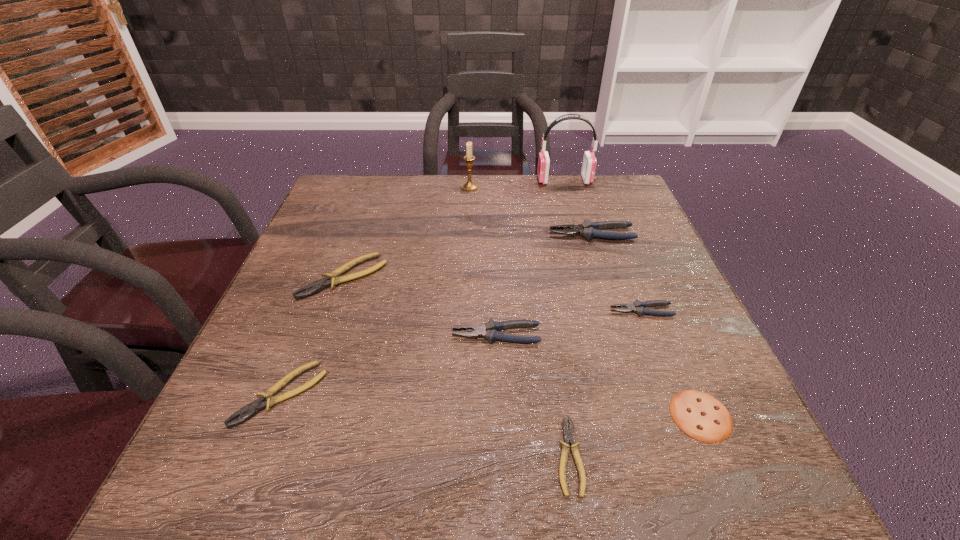
Find the location of `vacant space located on the back of the cookie`. vacant space located on the back of the cookie is located at coordinates (648, 291).

At what (x,y) coordinates should I click in order to perform the action: click on vacant space located 0.140m on the left of the shortest object. Please return your answer as a coordinate pair (x, y). Looking at the image, I should click on (464, 456).

Identify the location of earphone at the far edge. Image resolution: width=960 pixels, height=540 pixels. (589, 160).

Identify the location of candle holder present at the far edge. (469, 185).

I want to click on object that is at the near edge, so click(x=568, y=435).

This screenshot has width=960, height=540. I want to click on earphone at the right edge, so click(589, 160).

Find the location of `cookie at the right edge`. cookie at the right edge is located at coordinates [701, 416].

The height and width of the screenshot is (540, 960). Find the location of `object present at the far right corner`. object present at the far right corner is located at coordinates (589, 160).

What are the coordinates of `vacant space at the far edge of the desktop` in the screenshot? It's located at (455, 174).

In the image, there is a desktop. Identify the location of free space at the near edge. (610, 493).